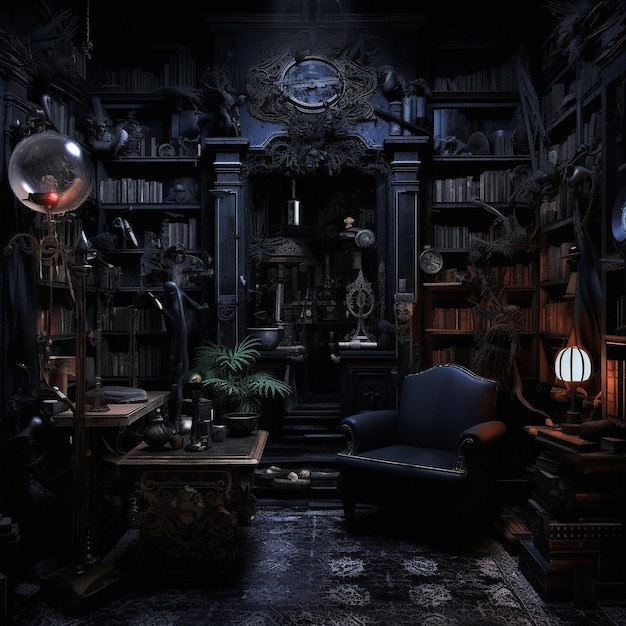
Locate an element on the screen. The image size is (626, 626). lamp is located at coordinates (576, 357).